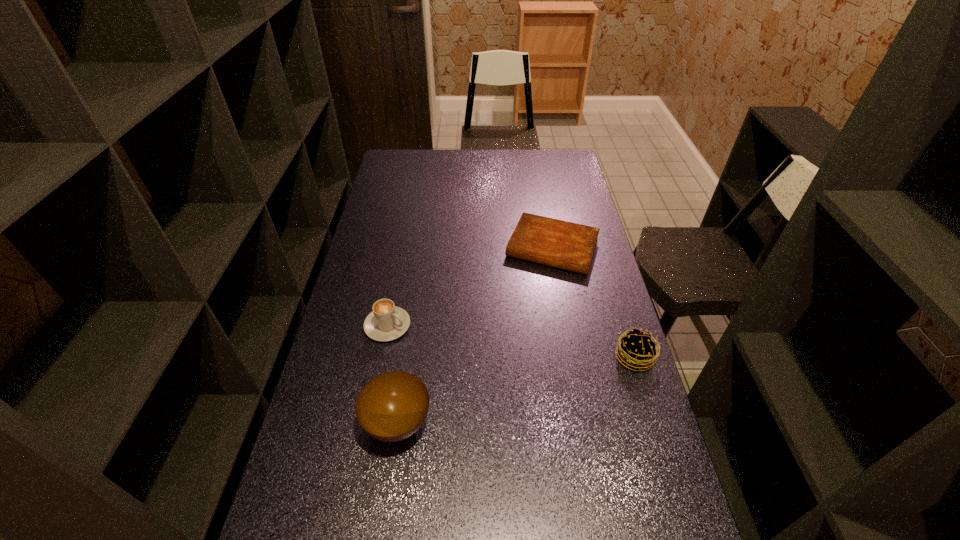
I want to click on vacant spot on the desktop that is between the bowl and the patty and is positioned on the spine side of the Bible, so click(x=495, y=396).

What are the coordinates of `free space on the desktop that is between the nearest object and the patty and is positioned to the right of the cappuccino` in the screenshot? It's located at (513, 391).